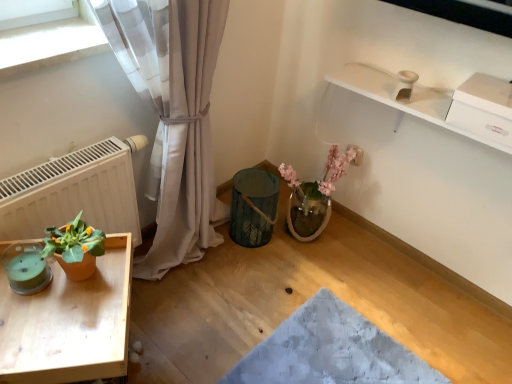
Question: Can you confirm if teal glass candle at lower left is positioned to the left of wooden tray at lower left?

Choices:
 (A) yes
 (B) no

Answer: (A)

Question: Is teal glass candle at lower left positioned before wooden tray at lower left?

Choices:
 (A) no
 (B) yes

Answer: (A)

Question: Is teal glass candle at lower left positioned behind wooden tray at lower left?

Choices:
 (A) yes
 (B) no

Answer: (A)

Question: Can you confirm if teal glass candle at lower left is bigger than wooden tray at lower left?

Choices:
 (A) yes
 (B) no

Answer: (B)

Question: Is teal glass candle at lower left aimed at wooden tray at lower left?

Choices:
 (A) yes
 (B) no

Answer: (A)

Question: Looking at the image, does white matte radiator at left seem bigger or smaller compared to wooden tray at lower left?

Choices:
 (A) big
 (B) small

Answer: (B)

Question: Considering the positions of point (145, 140) and point (102, 372), is point (145, 140) closer or farther from the camera than point (102, 372)?

Choices:
 (A) closer
 (B) farther

Answer: (B)

Question: Based on their positions, is white matte radiator at left located to the left or right of wooden tray at lower left?

Choices:
 (A) right
 (B) left

Answer: (B)

Question: From the image's perspective, relative to wooden tray at lower left, is white matte radiator at left above or below?

Choices:
 (A) below
 (B) above

Answer: (B)

Question: Considering the positions of point (119, 253) and point (12, 289), is point (119, 253) closer or farther from the camera than point (12, 289)?

Choices:
 (A) farther
 (B) closer

Answer: (A)

Question: From a real-world perspective, is wooden tray at lower left positioned above or below teal glass candle at lower left?

Choices:
 (A) below
 (B) above

Answer: (A)

Question: Based on their positions, is wooden tray at lower left located to the left or right of teal glass candle at lower left?

Choices:
 (A) left
 (B) right

Answer: (B)

Question: In terms of height, does wooden tray at lower left look taller or shorter compared to teal glass candle at lower left?

Choices:
 (A) tall
 (B) short

Answer: (A)

Question: In terms of width, does terracotta pot at left look wider or thinner when compared to white matte radiator at left?

Choices:
 (A) wide
 (B) thin

Answer: (A)

Question: Visually, is terracotta pot at left positioned to the left or to the right of white matte radiator at left?

Choices:
 (A) right
 (B) left

Answer: (A)